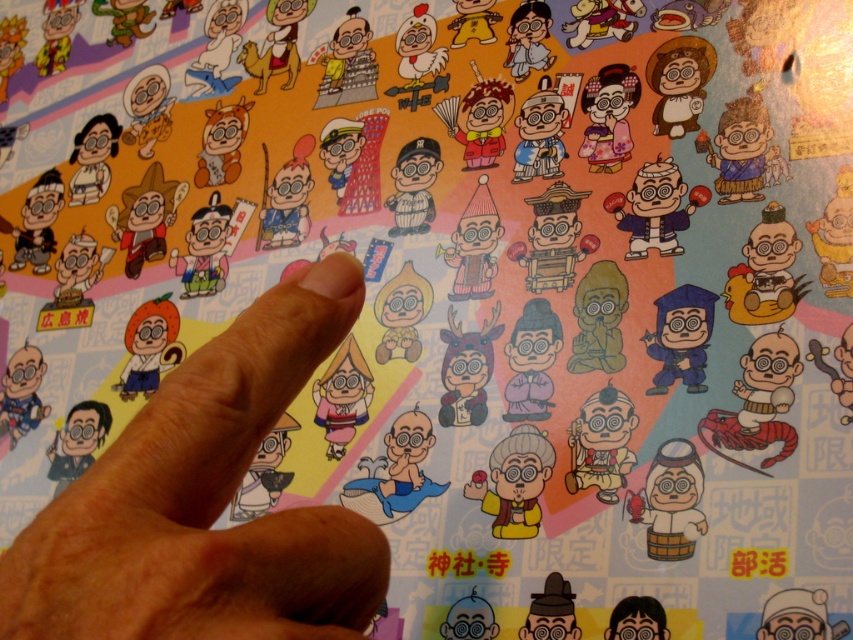
Question: Which point is farther to the camera?

Choices:
 (A) (210, 454)
 (B) (677, 323)

Answer: (B)

Question: Is brown skin at center behind blue matte graduation cap at lower right?

Choices:
 (A) yes
 (B) no

Answer: (B)

Question: Which point is closer to the camera taking this photo?

Choices:
 (A) (100, 624)
 (B) (686, 310)

Answer: (A)

Question: Does brown skin at center have a larger size compared to blue matte graduation cap at lower right?

Choices:
 (A) yes
 (B) no

Answer: (A)

Question: Which of the following is the farthest from the observer?

Choices:
 (A) blue matte graduation cap at lower right
 (B) brown skin at center

Answer: (A)

Question: Does brown skin at center appear on the left side of blue matte graduation cap at lower right?

Choices:
 (A) yes
 (B) no

Answer: (A)